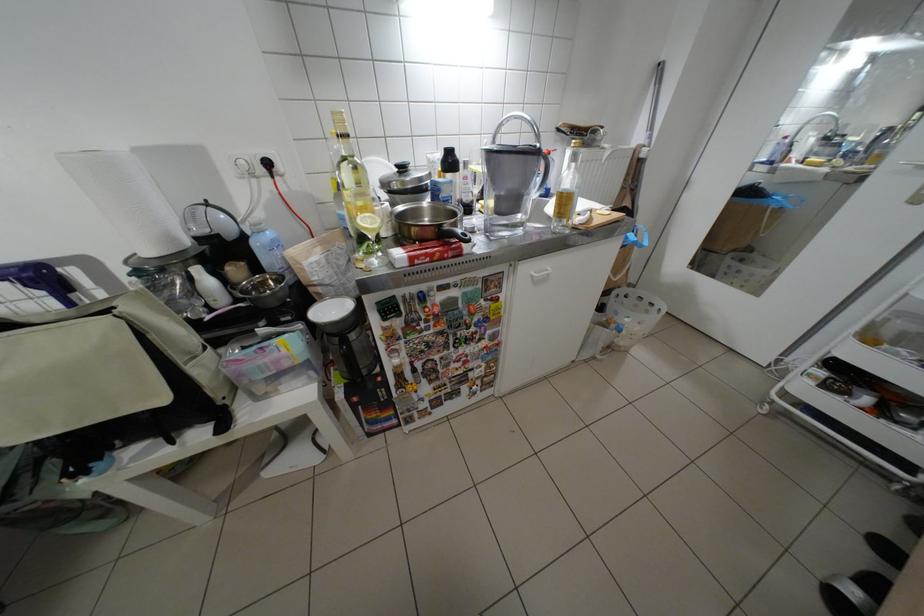
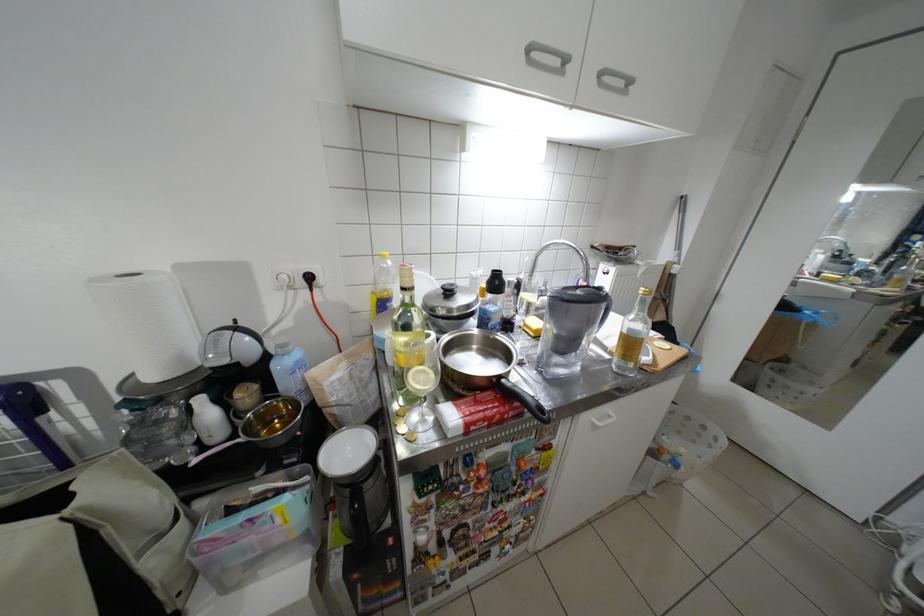
Question: The first image is from the beginning of the video and the second image is from the end. How did the camera likely rotate when shooting the video?

Choices:
 (A) Left
 (B) Right
 (C) Up
 (D) Down

Answer: (C)